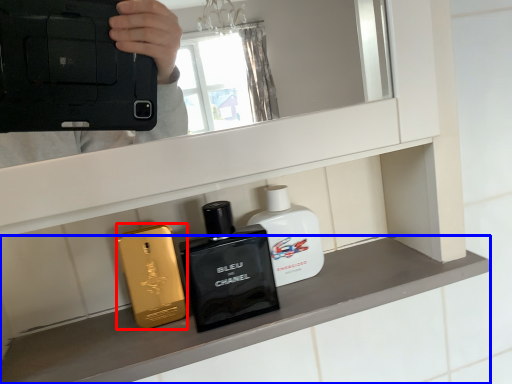
Question: Which of the following is the closest to the observer, perfume (highlighted by a red box) or mantle (highlighted by a blue box)?

Choices:
 (A) perfume
 (B) mantle

Answer: (B)